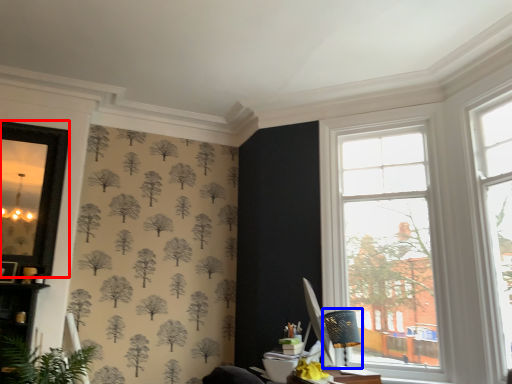
Question: Which of the following is the farthest to the observer, window screen (highlighted by a red box) or table lamp (highlighted by a blue box)?

Choices:
 (A) window screen
 (B) table lamp

Answer: (A)